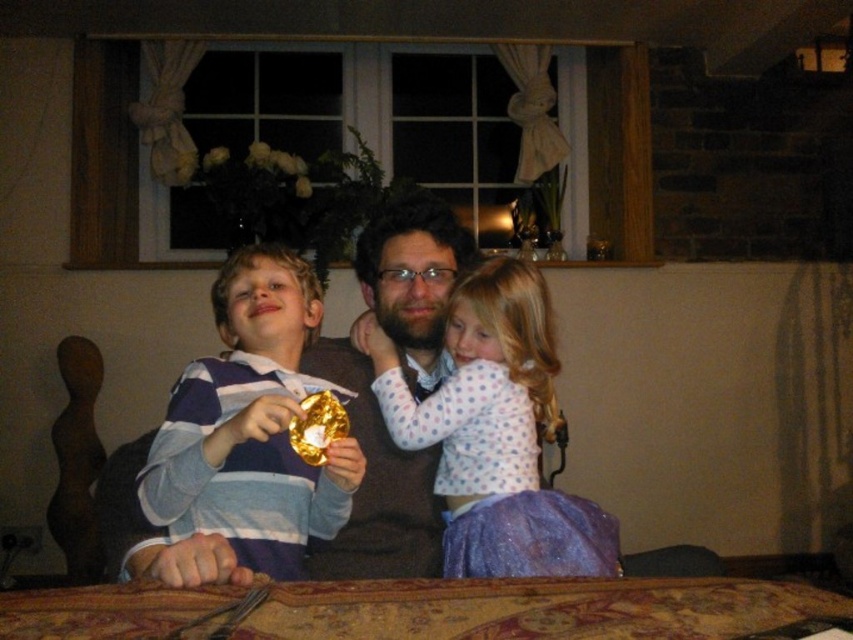
Question: Which object is positioned closest to the striped fabric shirt at left?

Choices:
 (A) wooden table at center
 (B) purple glitter dress at center

Answer: (B)

Question: Which object appears closest to the camera in this image?

Choices:
 (A) purple glitter dress at center
 (B) wooden table at center
 (C) striped fabric shirt at left

Answer: (B)

Question: Is striped fabric shirt at left below purple glitter dress at center?

Choices:
 (A) no
 (B) yes

Answer: (A)

Question: Can you confirm if wooden table at center is wider than purple glitter dress at center?

Choices:
 (A) no
 (B) yes

Answer: (B)

Question: Which is nearer to the striped fabric shirt at left?

Choices:
 (A) wooden table at center
 (B) purple glitter dress at center

Answer: (B)

Question: Can you confirm if wooden table at center is smaller than purple glitter dress at center?

Choices:
 (A) no
 (B) yes

Answer: (B)